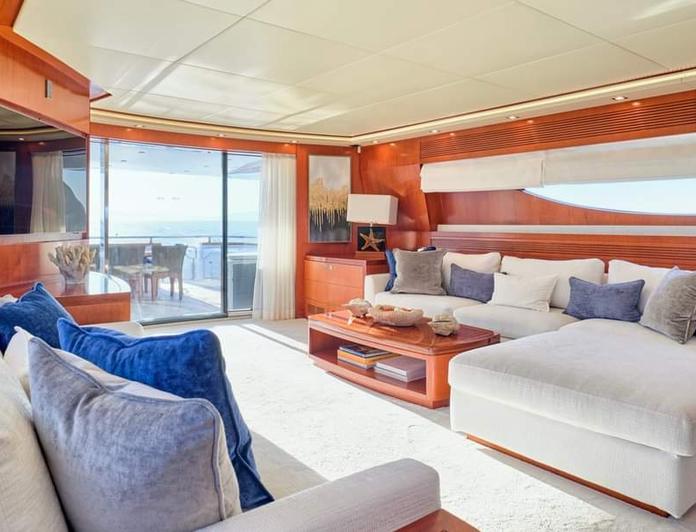
I want to click on lamp, so click(369, 211).